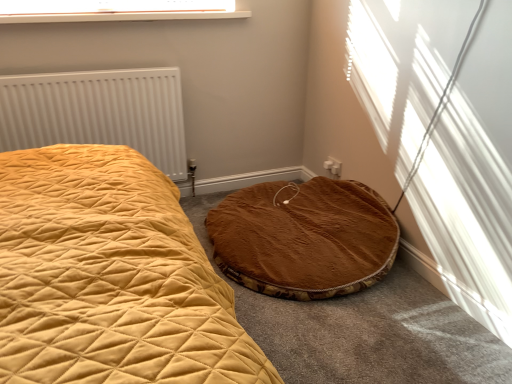
Question: From the image's perspective, is white textured radiator at left above clear plastic window screen at upper center?

Choices:
 (A) no
 (B) yes

Answer: (A)

Question: Is white textured radiator at left closer to the viewer compared to clear plastic window screen at upper center?

Choices:
 (A) yes
 (B) no

Answer: (B)

Question: From a real-world perspective, is white textured radiator at left positioned over clear plastic window screen at upper center based on gravity?

Choices:
 (A) yes
 (B) no

Answer: (B)

Question: Considering the relative positions of white textured radiator at left and clear plastic window screen at upper center in the image provided, is white textured radiator at left to the right of clear plastic window screen at upper center from the viewer's perspective?

Choices:
 (A) yes
 (B) no

Answer: (B)

Question: Is the depth of white textured radiator at left greater than that of clear plastic window screen at upper center?

Choices:
 (A) yes
 (B) no

Answer: (A)

Question: Which is correct: white textured radiator at left is inside brown plush cat bed at lower right, or outside of it?

Choices:
 (A) outside
 (B) inside

Answer: (A)

Question: Is white textured radiator at left to the left or to the right of brown plush cat bed at lower right in the image?

Choices:
 (A) left
 (B) right

Answer: (A)

Question: Considering the positions of point (182, 140) and point (338, 210), is point (182, 140) closer or farther from the camera than point (338, 210)?

Choices:
 (A) farther
 (B) closer

Answer: (A)

Question: From the image's perspective, is white textured radiator at left positioned above or below brown plush cat bed at lower right?

Choices:
 (A) below
 (B) above

Answer: (B)

Question: Considering the positions of white textured radiator at left and clear plastic window screen at upper center in the image, is white textured radiator at left wider or thinner than clear plastic window screen at upper center?

Choices:
 (A) thin
 (B) wide

Answer: (A)

Question: From their relative heights in the image, would you say white textured radiator at left is taller or shorter than clear plastic window screen at upper center?

Choices:
 (A) short
 (B) tall

Answer: (B)

Question: Does point (66, 82) appear closer or farther from the camera than point (28, 6)?

Choices:
 (A) closer
 (B) farther

Answer: (A)

Question: Considering their positions, is white textured radiator at left located in front of or behind clear plastic window screen at upper center?

Choices:
 (A) behind
 (B) front

Answer: (A)

Question: Is brown plush cat bed at lower right taller or shorter than white textured radiator at left?

Choices:
 (A) short
 (B) tall

Answer: (A)

Question: From the image's perspective, is brown plush cat bed at lower right located above or below white textured radiator at left?

Choices:
 (A) above
 (B) below

Answer: (B)